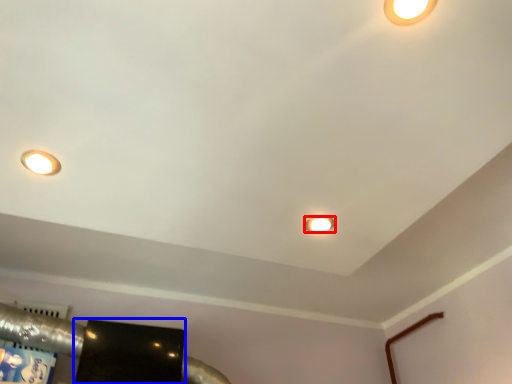
Question: Which object appears closest to the camera in this image, lamp (highlighted by a red box) or wide (highlighted by a blue box)?

Choices:
 (A) lamp
 (B) wide

Answer: (A)